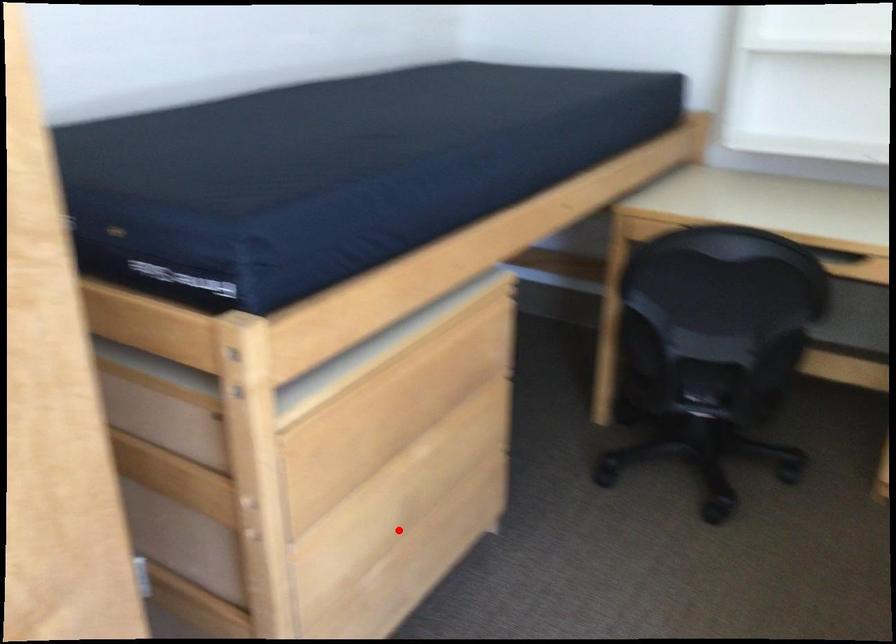
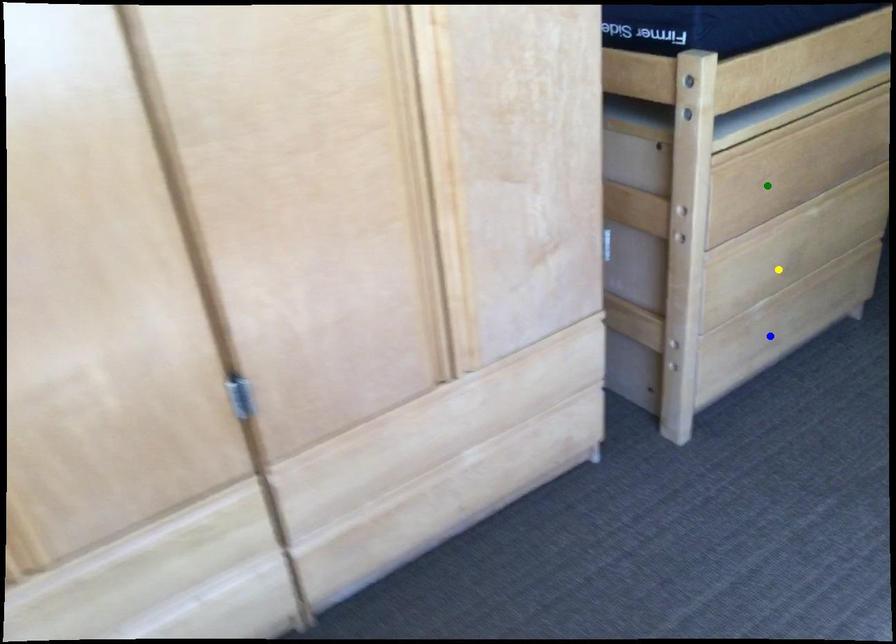
Question: I am providing you with two images of the same scene from different viewpoints. A red point is marked on the first image. You are given multiple points on the second image. Can you choose the point in image 2 that corresponds to the point in image 1?

Choices:
 (A) blue point
 (B) yellow point
 (C) green point

Answer: (B)